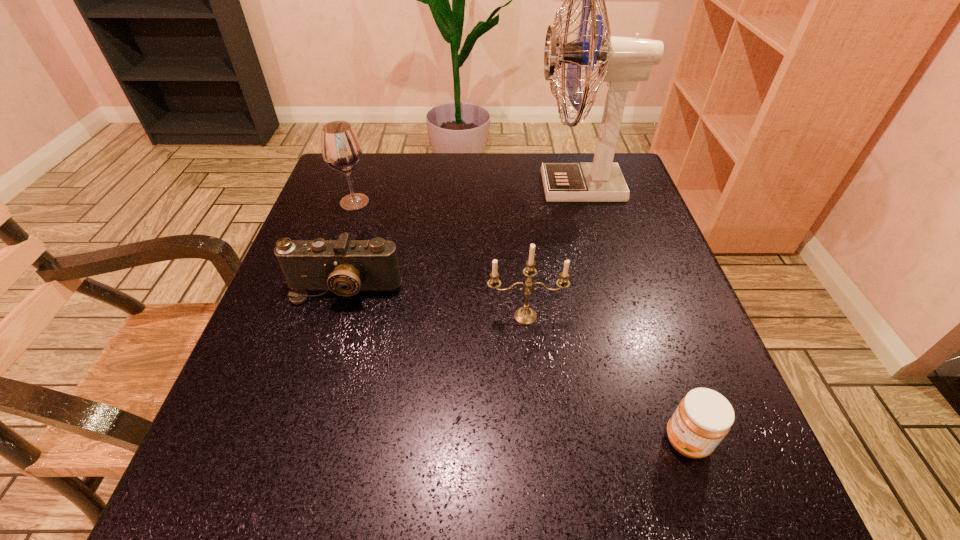
You are a GUI agent. You are given a task and a screenshot of the screen. Output one action in this format:
    pyautogui.click(x=<x>, y=<y>)
    Task: Click on the fan
    The image size is (960, 540).
    Given the screenshot: What is the action you would take?
    pyautogui.click(x=623, y=61)

Where is `wineglass`? The height and width of the screenshot is (540, 960). wineglass is located at coordinates point(341,149).

This screenshot has width=960, height=540. In order to click on candle in this screenshot , I will do `click(525, 315)`.

I want to click on the third nearest object, so click(x=345, y=267).

Where is `the nearest object`? The height and width of the screenshot is (540, 960). the nearest object is located at coordinates (704, 417).

Identify the location of vacant space located 0.130m on the front-facing side of the fan. The image size is (960, 540). click(x=484, y=186).

Image resolution: width=960 pixels, height=540 pixels. I want to click on vacant space located 0.260m on the front-facing side of the fan, so click(x=434, y=186).

The image size is (960, 540). Identify the location of free region located 0.150m on the front-facing side of the fan. (x=476, y=186).

The height and width of the screenshot is (540, 960). I want to click on vacant space situated 0.310m on the right of the wineglass, so click(x=498, y=202).

I want to click on vacant region located 0.170m on the left of the candle, so click(x=396, y=316).